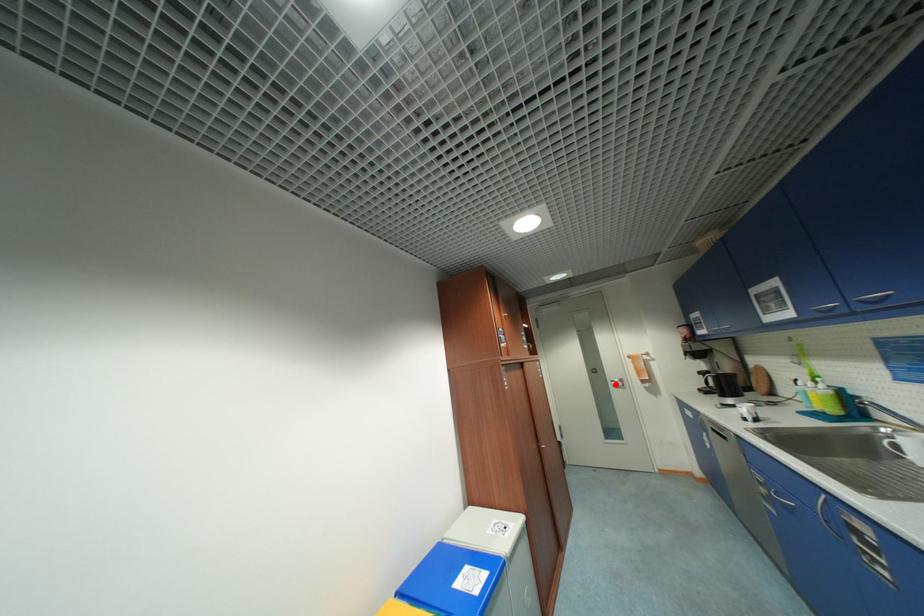
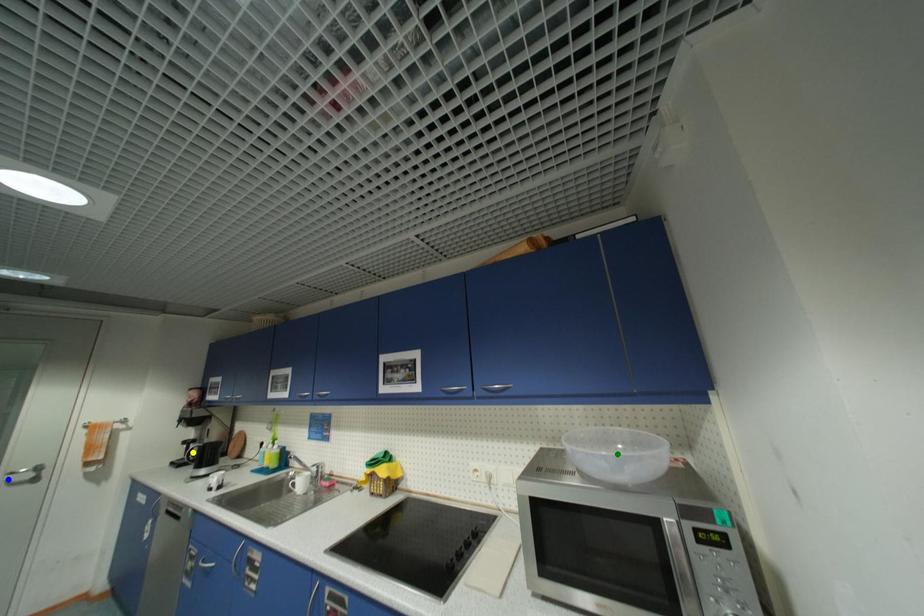
Question: I am providing you with two images of the same scene from different viewpoints. A red point is marked on the first image. You are given multiple points on the second image. Can you choose the point in image 2 that corresponds to the point in image 1?

Choices:
 (A) green point
 (B) blue point
 (C) yellow point

Answer: (B)